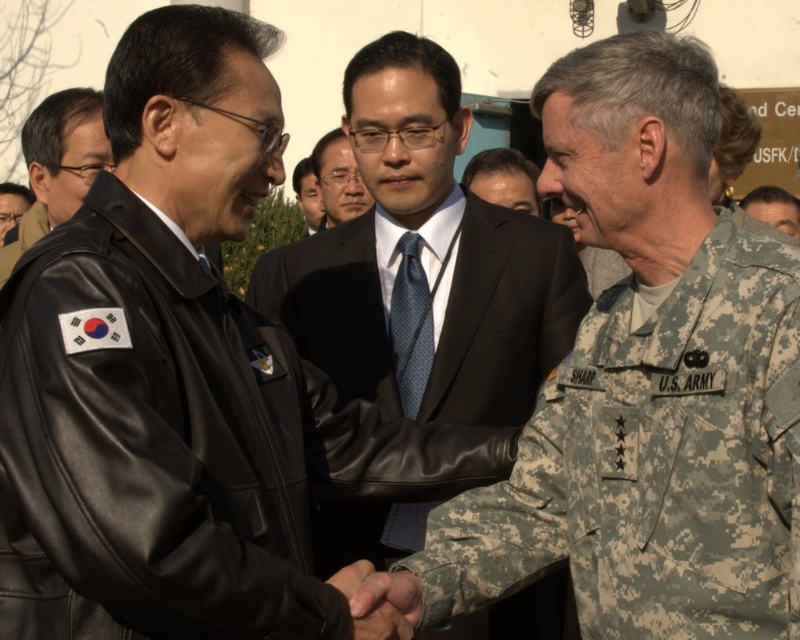
Question: Based on their relative distances, which object is nearer to the leather jacket at left?

Choices:
 (A) matte black suit at center
 (B) camouflage uniform at center
 (C) camouflage fabric us army uniform at center
 (D) camouflage fabric hand at center

Answer: (D)

Question: Estimate the real-world distances between objects in this image. Which object is farther from the camouflage fabric hand at center?

Choices:
 (A) dark suit at center
 (B) leather jacket at left
 (C) camouflage uniform at center

Answer: (A)

Question: Is dark blue silk tie at center to the right of leather jacket at left from the viewer's perspective?

Choices:
 (A) no
 (B) yes

Answer: (B)

Question: Is leather jacket at left positioned in front of matte black suit at center?

Choices:
 (A) no
 (B) yes

Answer: (B)

Question: In this image, where is camouflage fabric us army uniform at center located relative to camouflage fabric hand at center?

Choices:
 (A) above
 (B) below

Answer: (A)

Question: Which object is closer to the camera taking this photo?

Choices:
 (A) blue dotted fabric tie at center
 (B) leather jacket at left
 (C) dark suit at center

Answer: (B)